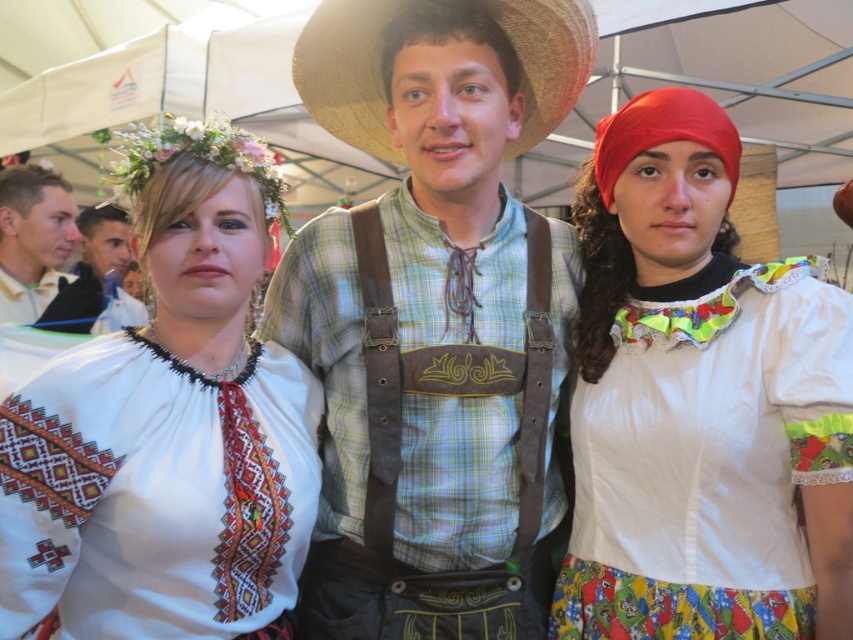
Question: Based on their relative distances, which object is nearer to the white cotton blouse at center?

Choices:
 (A) smooth white shirt at left
 (B) light brown hair at left

Answer: (A)

Question: Does green plaid shirt at center appear on the right side of strawmaterial/texturecowboy hat at center?

Choices:
 (A) no
 (B) yes

Answer: (A)

Question: Which point is closer to the camera?

Choices:
 (A) light brown hair at left
 (B) white cotton blouse at center

Answer: (B)

Question: Among these objects, which one is nearest to the camera?

Choices:
 (A) smooth white shirt at left
 (B) light brown hair at left

Answer: (A)

Question: Is green plaid shirt at center wider than white embroidered blouse at center?

Choices:
 (A) yes
 (B) no

Answer: (A)

Question: Is strawmaterial/texturecowboy hat at center closer to camera compared to light brown hair at left?

Choices:
 (A) yes
 (B) no

Answer: (A)